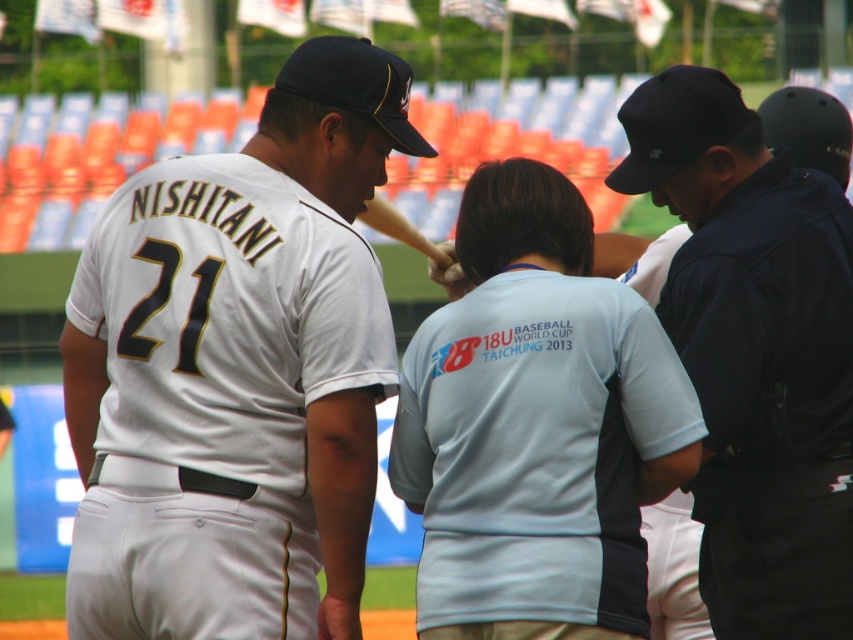
Question: Can you confirm if white jersey at center is positioned below light blue fabric shirt at center?

Choices:
 (A) yes
 (B) no

Answer: (B)

Question: Which point appears closest to the camera in this image?

Choices:
 (A) (x=538, y=333)
 (B) (x=384, y=60)

Answer: (A)

Question: Among these points, which one is farthest from the camera?

Choices:
 (A) (399, 424)
 (B) (299, 48)
 (C) (672, 291)

Answer: (B)

Question: Does dark blue uniform at center have a greater width compared to light blue fabric shirt at center?

Choices:
 (A) yes
 (B) no

Answer: (A)

Question: In this image, where is dark blue uniform at center located relative to light blue fabric shirt at center?

Choices:
 (A) right
 (B) left

Answer: (A)

Question: Which object is closer to the camera taking this photo?

Choices:
 (A) white jersey at center
 (B) dark blue uniform at center
 (C) light blue fabric shirt at center

Answer: (C)